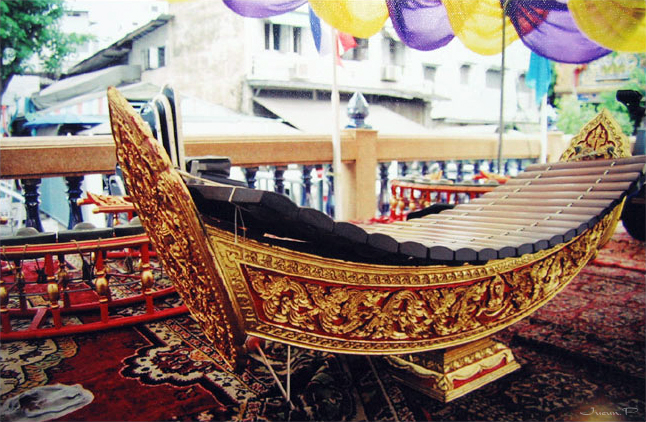
The height and width of the screenshot is (422, 646). I want to click on windows, so click(284, 43), click(359, 50), click(391, 57), click(430, 77), click(466, 77), click(494, 77), click(160, 58).